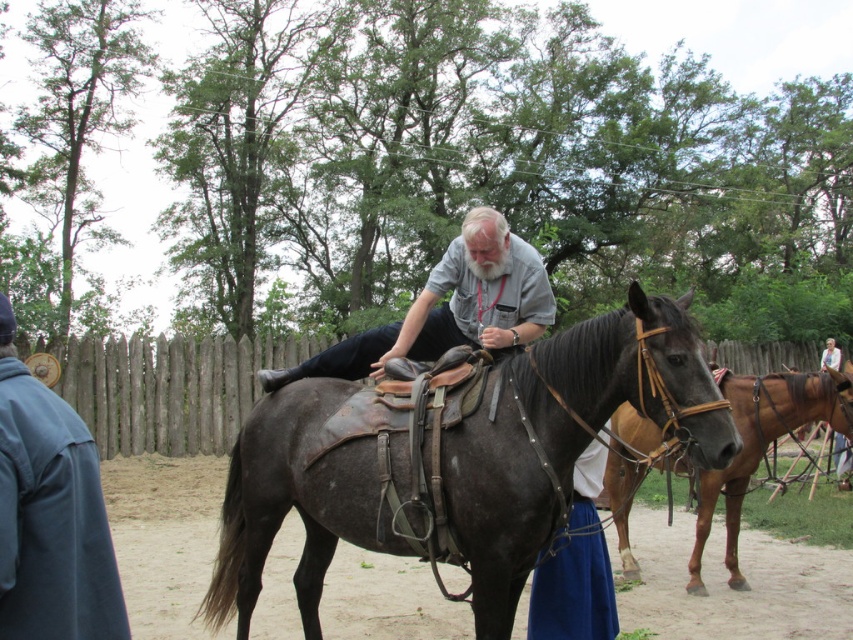
What do you see at coordinates (567, 436) in the screenshot?
I see `dark brown leather horse at center` at bounding box center [567, 436].

Who is taller, dark brown leather horse at center or blue cotton skirt at lower center?

dark brown leather horse at center

Is point (497, 429) in front of point (610, 592)?

Yes.

Where is `dark brown leather horse at center`? This screenshot has height=640, width=853. dark brown leather horse at center is located at coordinates tap(567, 436).

Is point (729, 490) positioned in front of point (537, 618)?

No, it is not.

The image size is (853, 640). In order to click on brown leather horse at center in this screenshot , I will do `click(762, 445)`.

What do you see at coordinates (762, 445) in the screenshot? I see `brown leather horse at center` at bounding box center [762, 445].

Where is `brown leather horse at center`? The height and width of the screenshot is (640, 853). brown leather horse at center is located at coordinates (762, 445).

Does gray matte shirt at center come behind brown leather horse at center?

That is False.

Looking at this image, between gray matte shirt at center and brown leather horse at center, which one appears on the left side from the viewer's perspective?

From the viewer's perspective, gray matte shirt at center appears more on the left side.

Is point (509, 264) less distant than point (762, 392)?

Yes, point (509, 264) is closer to viewer.

Locate an element on the screen. The height and width of the screenshot is (640, 853). gray matte shirt at center is located at coordinates (450, 307).